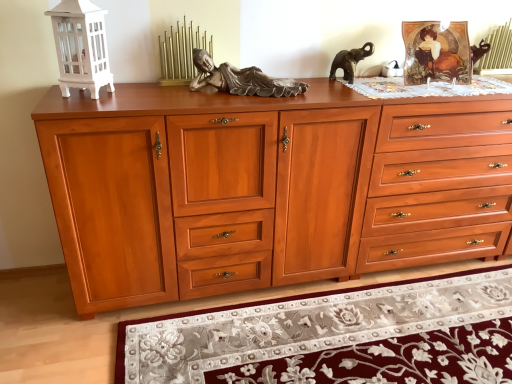
At what (x,y) coordinates should I click in order to perform the action: click on satin wood drawer at right, which ranks as the second drawer in left-to-right order. Please return your answer as a coordinate pair (x, y). This screenshot has height=384, width=512. Looking at the image, I should click on (438, 185).

Describe the element at coordinates (335, 336) in the screenshot. I see `floral rug at lower center` at that location.

The image size is (512, 384). Describe the element at coordinates (232, 185) in the screenshot. I see `cherry wood chest of drawers at center` at that location.

Where is `satin wood drawer at right, which ranks as the second drawer in left-to-right order`? satin wood drawer at right, which ranks as the second drawer in left-to-right order is located at coordinates (438, 185).

Consider the image. Is satin wood drawer at right, which ranks as the second drawer in left-to-right order, oriented towards satin wood drawer at center, the 2th drawer from the right?

Yes, satin wood drawer at right, which ranks as the second drawer in left-to-right order, is aimed at satin wood drawer at center, the 2th drawer from the right.

Is satin wood drawer at right, which is the 1th drawer from right to left, bigger than satin wood drawer at center, arranged as the first drawer when viewed from the left?

Incorrect, satin wood drawer at right, which is the 1th drawer from right to left, is not larger than satin wood drawer at center, arranged as the first drawer when viewed from the left.

Is satin wood drawer at right, which ranks as the second drawer in left-to-right order, to the left of satin wood drawer at center, arranged as the first drawer when viewed from the left, from the viewer's perspective?

No, satin wood drawer at right, which ranks as the second drawer in left-to-right order, is not to the left of satin wood drawer at center, arranged as the first drawer when viewed from the left.

Can you confirm if satin wood drawer at right, which ranks as the second drawer in left-to-right order, is wider than satin wood drawer at center, the 2th drawer from the right?

Yes.

Which is more distant, (197, 182) or (364, 265)?

Positioned behind is point (364, 265).

Which object is positioned more to the right, satin wood drawer at center, arranged as the first drawer when viewed from the left, or satin wood drawer at right, which is the 1th drawer from right to left?

From the viewer's perspective, satin wood drawer at right, which is the 1th drawer from right to left, appears more on the right side.

Is the position of satin wood drawer at center, the 2th drawer from the right, more distant than that of satin wood drawer at right, which is the 1th drawer from right to left?

No, the depth of satin wood drawer at center, the 2th drawer from the right, is less than that of satin wood drawer at right, which is the 1th drawer from right to left.

Considering the relative positions of floral rug at lower center and satin wood drawer at right, which is the 1th drawer from right to left, in the image provided, is floral rug at lower center behind satin wood drawer at right, which is the 1th drawer from right to left,?

No, floral rug at lower center is closer to the camera.

From the image's perspective, which object appears higher, floral rug at lower center or satin wood drawer at right, which ranks as the second drawer in left-to-right order?

From the image's view, satin wood drawer at right, which ranks as the second drawer in left-to-right order, is above.

Considering the relative sizes of floral rug at lower center and satin wood drawer at right, which is the 1th drawer from right to left, in the image provided, is floral rug at lower center shorter than satin wood drawer at right, which is the 1th drawer from right to left,?

Indeed, floral rug at lower center has a lesser height compared to satin wood drawer at right, which is the 1th drawer from right to left.

Identify the location of mat in front of the satin wood drawer at right, which ranks as the second drawer in left-to-right order. (335, 336).

Does point (368, 373) lie behind point (104, 274)?

No, (368, 373) is closer to viewer.

Is floral rug at lower center facing towards cherry wood chest of drawers at center?

Yes, floral rug at lower center faces towards cherry wood chest of drawers at center.

Are floral rug at lower center and cherry wood chest of drawers at center beside each other?

floral rug at lower center and cherry wood chest of drawers at center are not in contact.

Considering the relative sizes of floral rug at lower center and cherry wood chest of drawers at center in the image provided, is floral rug at lower center bigger than cherry wood chest of drawers at center?

No, floral rug at lower center is not bigger than cherry wood chest of drawers at center.

Which is closer to the camera, (472, 222) or (282, 280)?

The point (282, 280) is closer to the camera.

Which of these two, satin wood drawer at right, which is the 1th drawer from right to left, or cherry wood chest of drawers at center, is bigger?

cherry wood chest of drawers at center is bigger.

Considering the positions of objects satin wood drawer at right, which ranks as the second drawer in left-to-right order, and cherry wood chest of drawers at center in the image provided, who is in front, satin wood drawer at right, which ranks as the second drawer in left-to-right order, or cherry wood chest of drawers at center?

cherry wood chest of drawers at center is closer to the camera.

From the image's perspective, does satin wood drawer at right, which is the 1th drawer from right to left, appear lower than cherry wood chest of drawers at center?

No, from the image's perspective, satin wood drawer at right, which is the 1th drawer from right to left, is not beneath cherry wood chest of drawers at center.

Is cherry wood chest of drawers at center smaller than satin wood drawer at right, which ranks as the second drawer in left-to-right order?

Incorrect, cherry wood chest of drawers at center is not smaller in size than satin wood drawer at right, which ranks as the second drawer in left-to-right order.

From the image's perspective, which one is positioned higher, cherry wood chest of drawers at center or satin wood drawer at right, which ranks as the second drawer in left-to-right order?

satin wood drawer at right, which ranks as the second drawer in left-to-right order, is shown above in the image.

Considering the positions of objects cherry wood chest of drawers at center and satin wood drawer at right, which is the 1th drawer from right to left, in the image provided, who is more to the right, cherry wood chest of drawers at center or satin wood drawer at right, which is the 1th drawer from right to left,?

From the viewer's perspective, satin wood drawer at right, which is the 1th drawer from right to left, appears more on the right side.

Is cherry wood chest of drawers at center facing towards satin wood drawer at right, which ranks as the second drawer in left-to-right order?

Yes, cherry wood chest of drawers at center is facing satin wood drawer at right, which ranks as the second drawer in left-to-right order.

Which of these two, satin wood drawer at right, which is the 1th drawer from right to left, or floral rug at lower center, is thinner?

satin wood drawer at right, which is the 1th drawer from right to left, is thinner.

Find the location of `mat in front of the satin wood drawer at right, which ranks as the second drawer in left-to-right order`. mat in front of the satin wood drawer at right, which ranks as the second drawer in left-to-right order is located at coordinates (335, 336).

Is satin wood drawer at right, which ranks as the second drawer in left-to-right order, inside the boundaries of floral rug at lower center, or outside?

satin wood drawer at right, which ranks as the second drawer in left-to-right order, is not inside floral rug at lower center, it's outside.

Image resolution: width=512 pixels, height=384 pixels. In order to click on drawer that is under the satin wood drawer at center, arranged as the first drawer when viewed from the left (from a real-world perspective) in this screenshot , I will do `click(438, 185)`.

The height and width of the screenshot is (384, 512). I want to click on drawer lying below the satin wood drawer at right, which ranks as the second drawer in left-to-right order (from the image's perspective), so click(222, 162).

Considering their positions, is satin wood drawer at center, arranged as the first drawer when viewed from the left, positioned further to floral rug at lower center than cherry wood chest of drawers at center?

satin wood drawer at center, arranged as the first drawer when viewed from the left, is positioned further to the anchor floral rug at lower center.

In the scene shown: Considering their positions, is satin wood drawer at center, arranged as the first drawer when viewed from the left, positioned further to floral rug at lower center than satin wood drawer at right, which is the 1th drawer from right to left?

satin wood drawer at center, arranged as the first drawer when viewed from the left, is further to floral rug at lower center.

Looking at the image, which one is located further to satin wood drawer at center, arranged as the first drawer when viewed from the left, cherry wood chest of drawers at center or satin wood drawer at right, which ranks as the second drawer in left-to-right order?

satin wood drawer at right, which ranks as the second drawer in left-to-right order, is positioned further to the anchor satin wood drawer at center, arranged as the first drawer when viewed from the left.

Considering their positions, is cherry wood chest of drawers at center positioned closer to floral rug at lower center than satin wood drawer at center, arranged as the first drawer when viewed from the left?

Based on the image, cherry wood chest of drawers at center appears to be nearer to floral rug at lower center.

Consider the image. From the image, which object appears to be farther from cherry wood chest of drawers at center, floral rug at lower center or satin wood drawer at right, which ranks as the second drawer in left-to-right order?

The object further to cherry wood chest of drawers at center is floral rug at lower center.

Considering their positions, is cherry wood chest of drawers at center positioned further to floral rug at lower center than satin wood drawer at right, which is the 1th drawer from right to left?

Among the two, satin wood drawer at right, which is the 1th drawer from right to left, is located further to floral rug at lower center.

Looking at the image, which one is located further to satin wood drawer at right, which ranks as the second drawer in left-to-right order, cherry wood chest of drawers at center or floral rug at lower center?

Among the two, floral rug at lower center is located further to satin wood drawer at right, which ranks as the second drawer in left-to-right order.

When comparing their distances from floral rug at lower center, does satin wood drawer at right, which is the 1th drawer from right to left, or cherry wood chest of drawers at center seem closer?

cherry wood chest of drawers at center lies closer to floral rug at lower center than the other object.

At what (x,y) coordinates should I click in order to perform the action: click on the chest of drawers that lies between satin wood drawer at center, the 2th drawer from the right, and floral rug at lower center from top to bottom. Please return your answer as a coordinate pair (x, y). The image size is (512, 384). Looking at the image, I should click on (232, 185).

In order to click on chest of drawers between satin wood drawer at center, the 2th drawer from the right, and satin wood drawer at right, which ranks as the second drawer in left-to-right order, in the horizontal direction in this screenshot , I will do `click(232, 185)`.

The width and height of the screenshot is (512, 384). Identify the location of the chest of drawers between satin wood drawer at right, which is the 1th drawer from right to left, and floral rug at lower center vertically. (232, 185).

Find the location of a particular element. Image resolution: width=512 pixels, height=384 pixels. mat between satin wood drawer at center, arranged as the first drawer when viewed from the left, and satin wood drawer at right, which ranks as the second drawer in left-to-right order, from left to right is located at coordinates (335, 336).